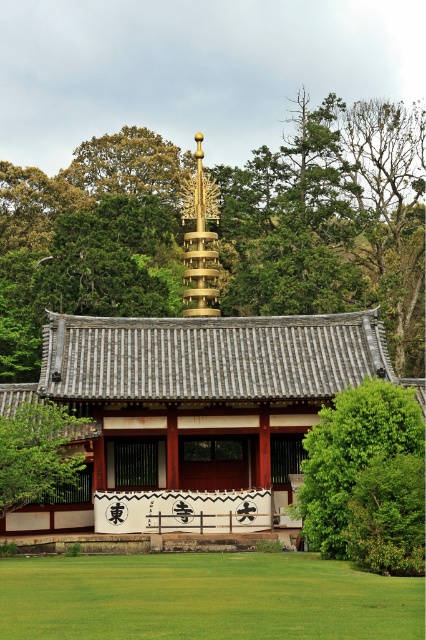
Can you confirm if green leafy tree at center is positioned below green grass at lower center?

No, green leafy tree at center is not below green grass at lower center.

Does green leafy tree at center have a lesser width compared to green grass at lower center?

No.

Between point (39, 337) and point (85, 582), which one is positioned in front?

Point (85, 582) is in front.

Where is `green leafy tree at center`? Image resolution: width=426 pixels, height=640 pixels. green leafy tree at center is located at coordinates (331, 220).

Find the location of a particular element. Image resolution: width=426 pixels, height=640 pixels. green leafy tree at right is located at coordinates pyautogui.click(x=367, y=477).

Does green leafy tree at right have a smaller size compared to green leafy tree at lower left?

Incorrect, green leafy tree at right is not smaller in size than green leafy tree at lower left.

This screenshot has height=640, width=426. I want to click on green leafy tree at right, so click(367, 477).

You are a GUI agent. You are given a task and a screenshot of the screen. Output one action in this format:
    pyautogui.click(x=<x>, y=<y>)
    Task: Click on the green leafy tree at right
    
    Given the screenshot: What is the action you would take?
    pyautogui.click(x=367, y=477)

Measure the distance between point (127, 579) and camera.

Point (127, 579) is 32.06 meters from camera.

Looking at this image, does green grass at lower center come behind green leafy tree at right?

No, it is not.

The image size is (426, 640). What are the coordinates of `green grass at lower center` in the screenshot? It's located at tap(206, 598).

Find the location of a particular element. This screenshot has width=426, height=640. green grass at lower center is located at coordinates (206, 598).